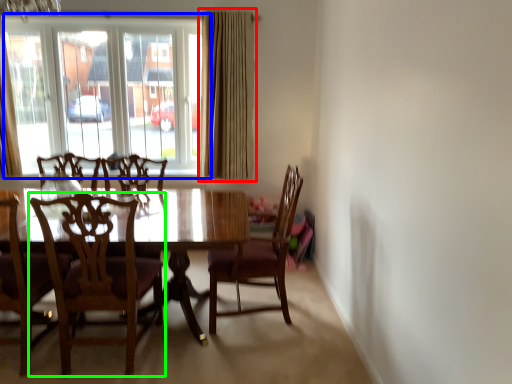
Question: Which object is positioned farthest from curtain (highlighted by a red box)? Select from window (highlighted by a blue box) and chair (highlighted by a green box).

Choices:
 (A) window
 (B) chair

Answer: (B)